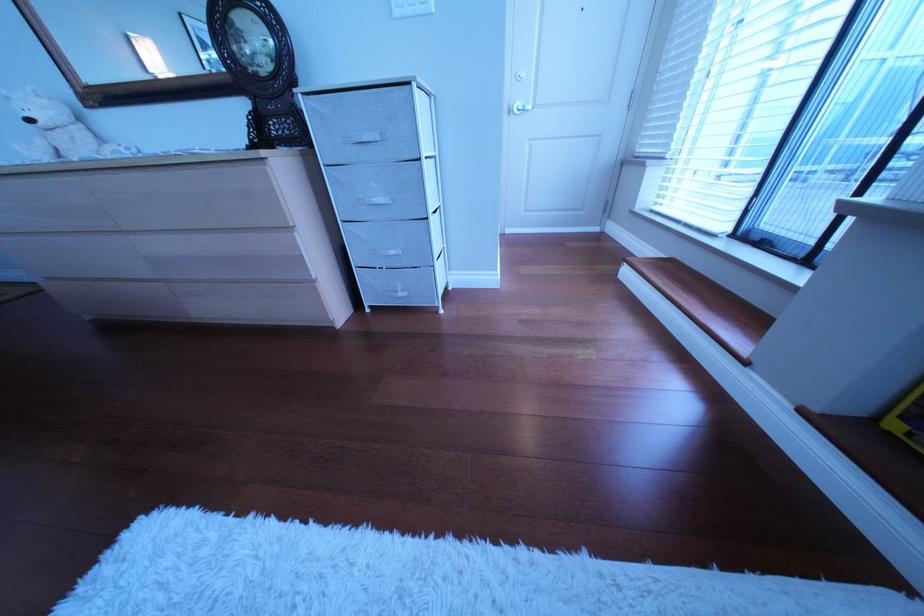
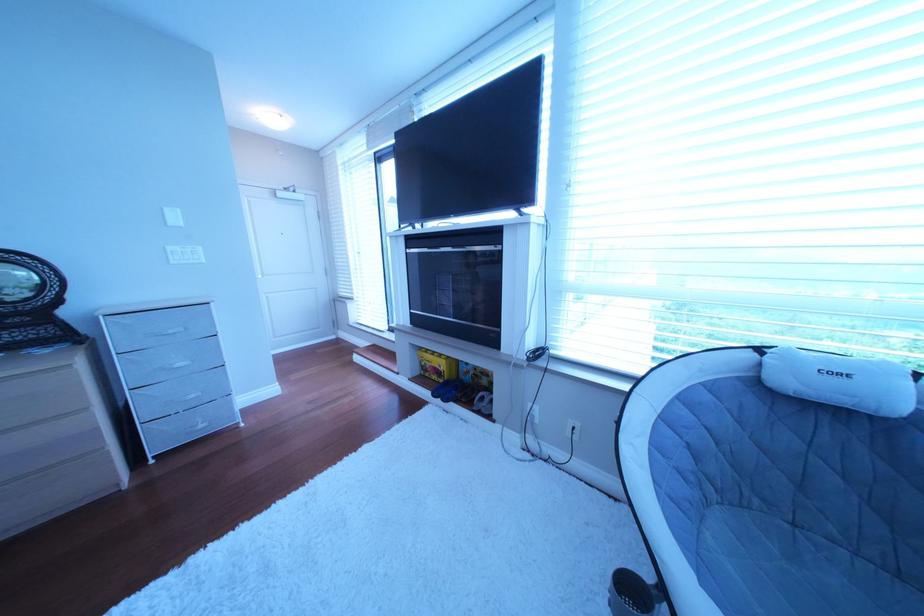
In the second image, find the point that corresponds to pixel 382 140 in the first image.

(188, 334)